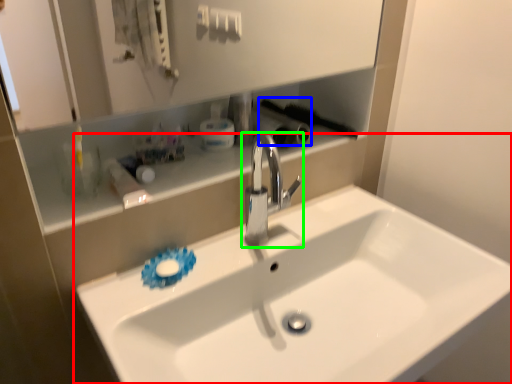
Question: Which object is the farthest from sink (highlighted by a red box)? Choose among these: brush (highlighted by a blue box) or tap (highlighted by a green box).

Choices:
 (A) brush
 (B) tap

Answer: (A)